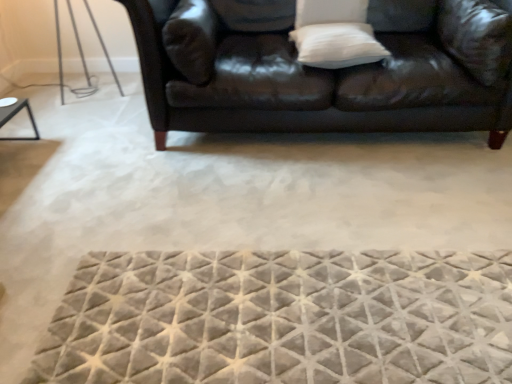
Question: Visually, is white soft pillow at upper center, which is the 3th pillow in right-to-left order, positioned to the left or to the right of textured gray mat at center?

Choices:
 (A) left
 (B) right

Answer: (B)

Question: Is white soft pillow at upper center, which is the 3th pillow in right-to-left order, inside or outside of textured gray mat at center?

Choices:
 (A) inside
 (B) outside

Answer: (B)

Question: Based on their relative distances, which object is farther from the white soft pillow at upper center, arranged as the first pillow when viewed from the left?

Choices:
 (A) white soft pillow at upper right, marked as the 3th pillow in a left-to-right arrangement
 (B) textured gray mat at center
 (C) leather couch at upper center
 (D) white soft pillow at upper center, which ranks as the 2th pillow in left-to-right order

Answer: (B)

Question: Estimate the real-world distances between objects in this image. Which object is closer to the leather couch at upper center?

Choices:
 (A) white soft pillow at upper center, the second pillow from the right
 (B) textured gray mat at center
 (C) white soft pillow at upper center, which is the 3th pillow in right-to-left order
 (D) white soft pillow at upper right, the first pillow in the right-to-left sequence

Answer: (C)